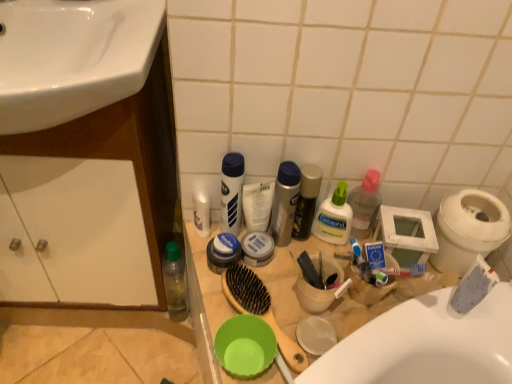
This screenshot has height=384, width=512. Find the location of `free space in front of silver metallic can at center, positioned as the fifth toiletry in left-to-right order`. free space in front of silver metallic can at center, positioned as the fifth toiletry in left-to-right order is located at coordinates (276, 288).